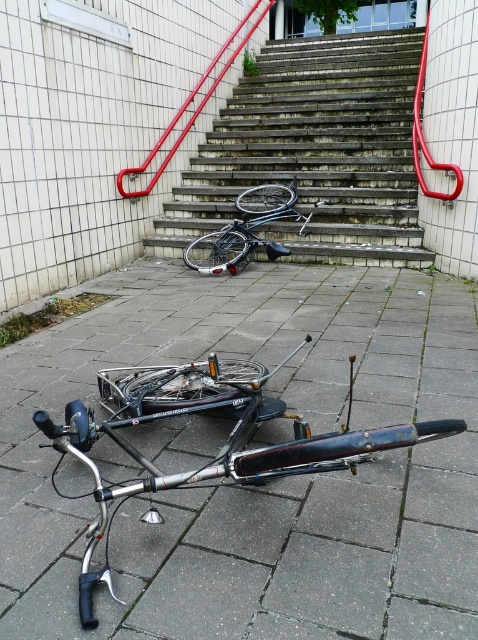
You are standing in front of the two bicycles lying on the ground. There are two points marked on the ground near the bicycles. The first point is at coordinate (284,52) and the second is at (249,214). If you want to place a small marker closer to the camera, which point should you choose?

You should choose point (284,52) because it is further to the camera than point (249,214).

You are a delivery person who needs to move the shiny metallic bicycle at center to the other side of the concrete stairs at center. Considering the size difference between them, do you think the bicycle will fit through the space between the stairs and the wall?

The concrete stairs at center has a larger size compared to the shiny metallic bicycle at center, so the bicycle should fit through the space between the stairs and the wall since it is smaller than the stairs.

You are standing at the base of the stairs in the scene. You want to place a small potted plant exactly at the point marked by the coordinates point (270, 483). Based on the scene description, what type of surface will the plant be placed on?

The point (270, 483) marks smooth concrete pavement at center, so the potted plant will be placed on smooth concrete pavement.